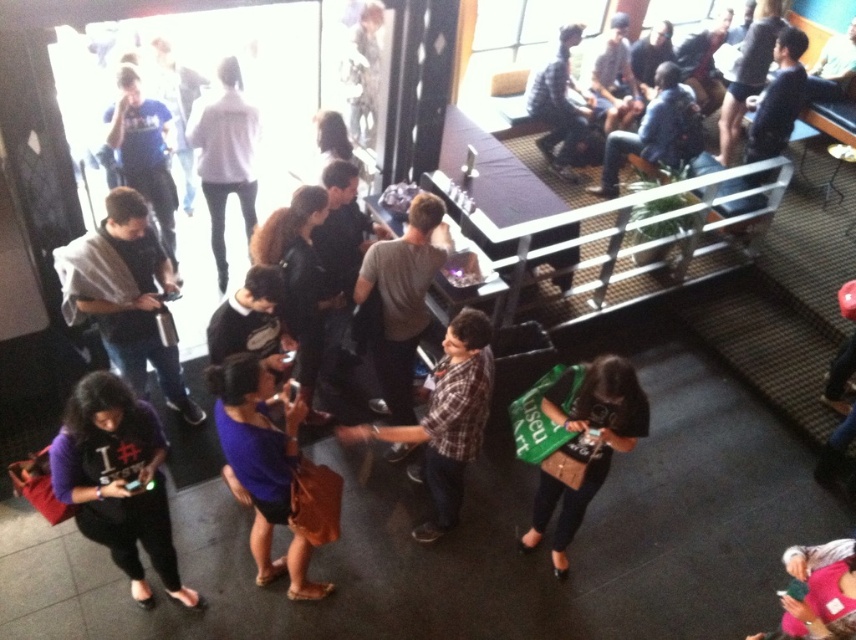
You are at the center of the room and notice a green fabric bag at center. Can you estimate its position relative to your current location?

The green fabric bag at center is located at point coordinates approximately 0.697 on the x axis and 0.683 on the y axis, so it is positioned slightly to the right and forward from your current central position.

From the picture: You are at a social event and need to place your items on a table. You have a green fabric bag at center and a matte black shirt at left. Which item should you choose if you need to place something that takes up more vertical space?

The green fabric bag at center should be chosen because it has a greater height compared to the matte black shirt at left, meaning it occupies more vertical space.

You are at a social event and want to locate the light gray sweater at center. Where is it positioned in the image?

The light gray sweater at center is positioned at point coordinates of 0.244 on the x axis and 0.263 on the y axis.